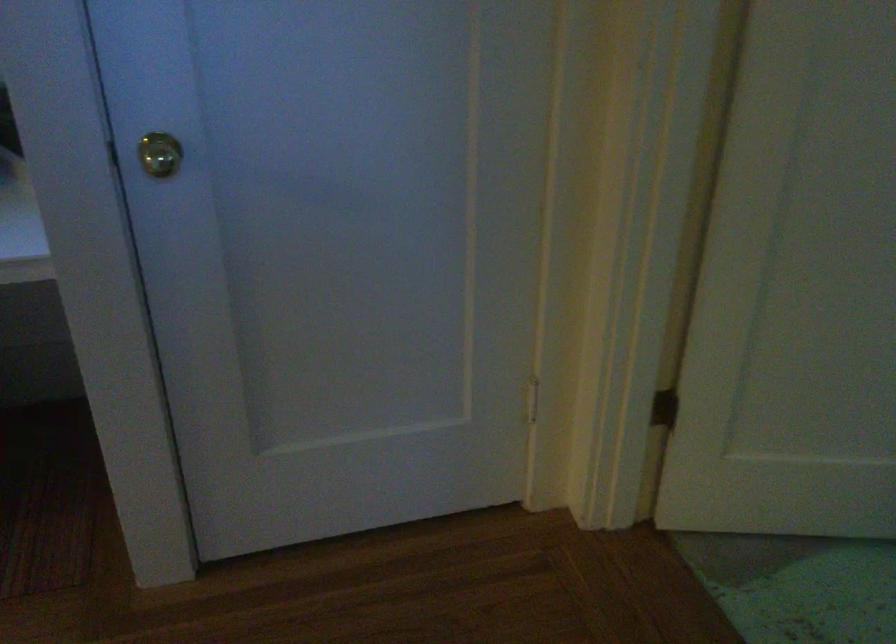
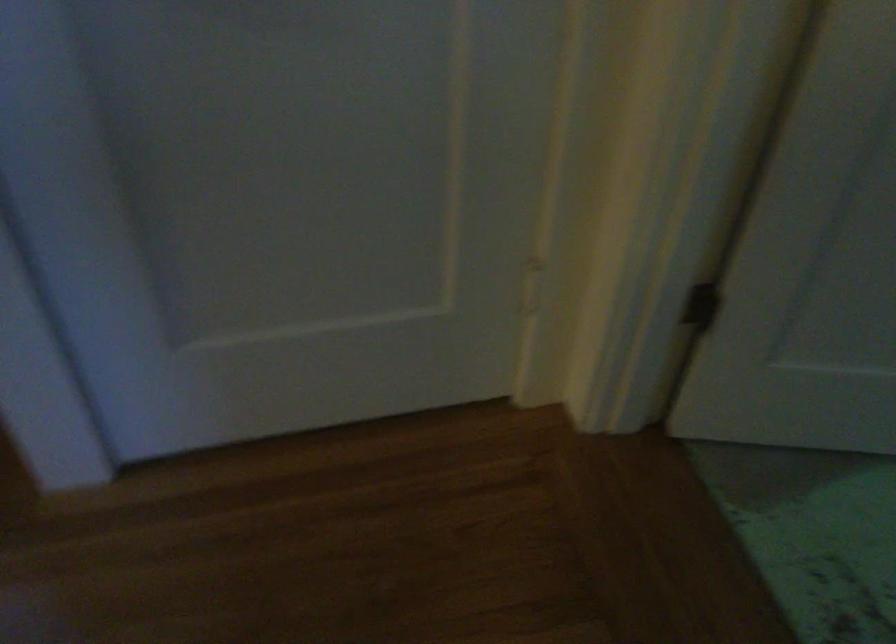
Question: How did the camera likely rotate?

Choices:
 (A) Left
 (B) Right
 (C) Up
 (D) Down

Answer: (D)